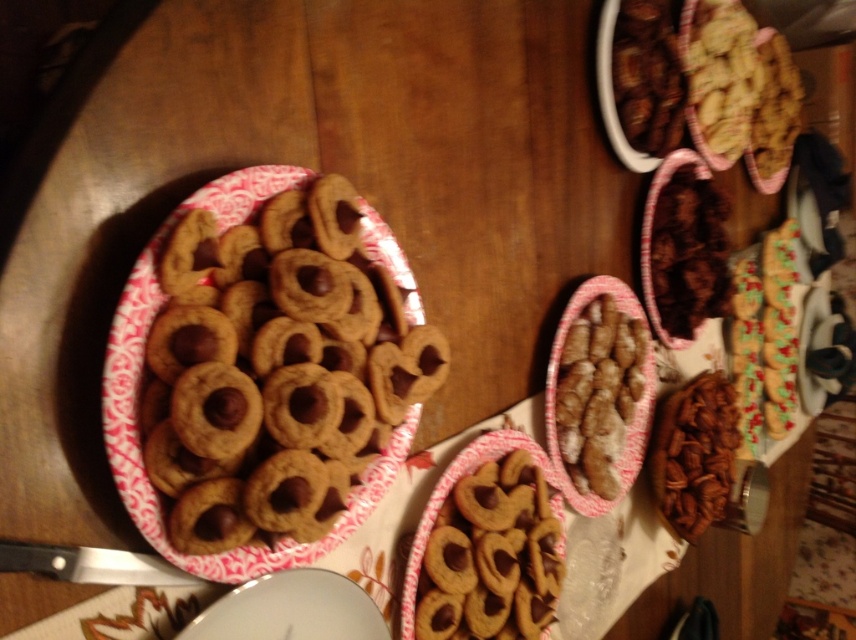
Is brown crunchy pecans at center further to the viewer compared to chocolate-coated nuts at center?

That is False.

Between point (711, 499) and point (729, 300), which one is positioned behind?

Point (729, 300)

Where is `brown crunchy pecans at center`? This screenshot has height=640, width=856. brown crunchy pecans at center is located at coordinates (694, 452).

Does brown crumbly cookie at center appear under chocolate-coated nuts at center?

Indeed, brown crumbly cookie at center is positioned under chocolate-coated nuts at center.

Does point (605, 458) lie behind point (693, 312)?

No, it is not.

Which is in front, point (619, 330) or point (666, 193)?

Positioned in front is point (619, 330).

At what (x,y) coordinates should I click in order to perform the action: click on brown crumbly cookie at center. Please return your answer as a coordinate pair (x, y). This screenshot has width=856, height=640. Looking at the image, I should click on (598, 392).

Which is below, golden brown cookie dough at center or chocolate-coated nuts at upper right?

golden brown cookie dough at center is lower down.

Can you confirm if golden brown cookie dough at center is shorter than chocolate-coated nuts at upper right?

No.

The height and width of the screenshot is (640, 856). Describe the element at coordinates (276, 371) in the screenshot. I see `golden brown cookie dough at center` at that location.

The height and width of the screenshot is (640, 856). I want to click on golden brown cookie dough at center, so click(276, 371).